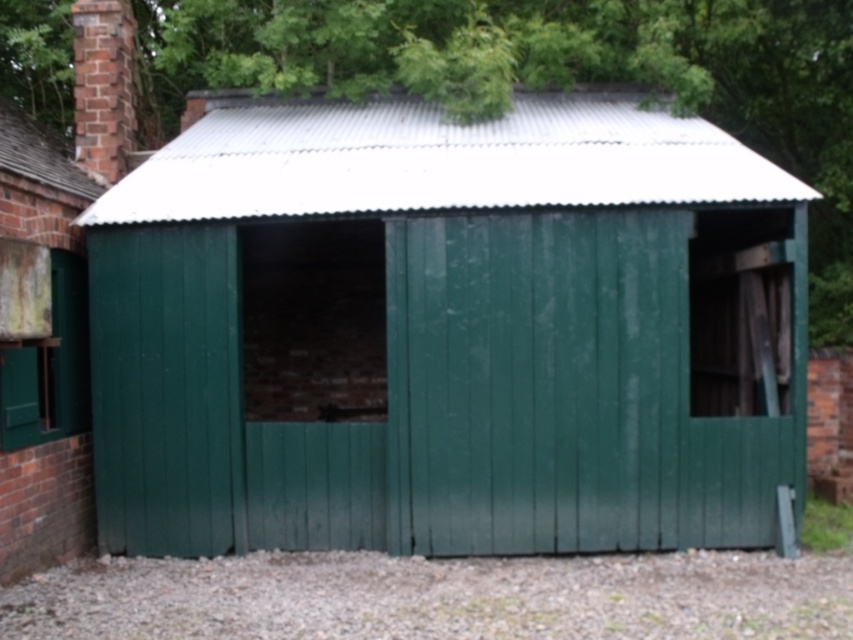
Question: Does green woodshed at center have a lesser width compared to brick chimney at upper left?

Choices:
 (A) no
 (B) yes

Answer: (A)

Question: Does green woodshed at center have a lesser width compared to brick chimney at upper left?

Choices:
 (A) no
 (B) yes

Answer: (A)

Question: Which point is farther to the camera?

Choices:
 (A) (193, 163)
 (B) (128, 12)

Answer: (B)

Question: Among these points, which one is farthest from the camera?

Choices:
 (A) (111, 51)
 (B) (780, 461)

Answer: (A)

Question: Can you confirm if green woodshed at center is smaller than brick chimney at upper left?

Choices:
 (A) yes
 (B) no

Answer: (B)

Question: Which object appears farthest from the camera in this image?

Choices:
 (A) brick chimney at upper left
 (B) green woodshed at center

Answer: (A)